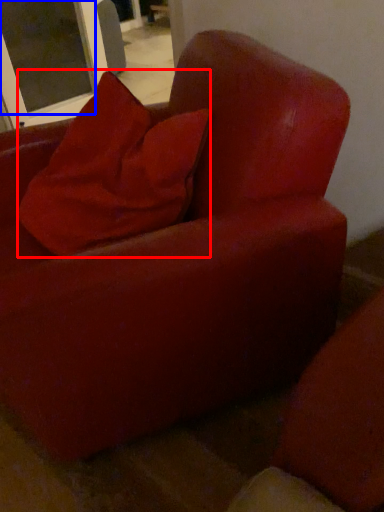
Question: Among these objects, which one is nearest to the camera, pillow (highlighted by a red box) or screen door (highlighted by a blue box)?

Choices:
 (A) pillow
 (B) screen door

Answer: (A)